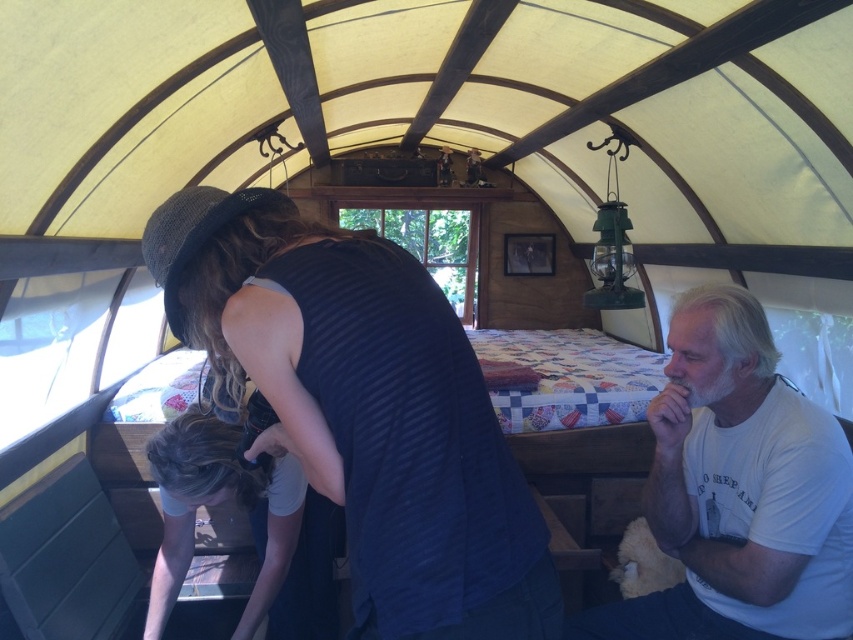
Does white cotton t-shirt at right appear on the left side of dark blue fabric at center?

Incorrect, white cotton t-shirt at right is not on the left side of dark blue fabric at center.

Can you confirm if white cotton t-shirt at right is positioned below dark blue fabric at center?

No, white cotton t-shirt at right is not below dark blue fabric at center.

This screenshot has width=853, height=640. In order to click on white cotton t-shirt at right in this screenshot , I will do `click(740, 490)`.

Is dark blue ribbed tank top at center to the right of white cotton t-shirt at right from the viewer's perspective?

In fact, dark blue ribbed tank top at center is to the left of white cotton t-shirt at right.

Between dark blue ribbed tank top at center and white cotton t-shirt at right, which one has more height?

With more height is white cotton t-shirt at right.

Image resolution: width=853 pixels, height=640 pixels. Describe the element at coordinates (364, 408) in the screenshot. I see `dark blue ribbed tank top at center` at that location.

The height and width of the screenshot is (640, 853). I want to click on dark blue ribbed tank top at center, so click(x=364, y=408).

Does dark blue ribbed tank top at center have a greater width compared to dark blue fabric at center?

Yes, dark blue ribbed tank top at center is wider than dark blue fabric at center.

Image resolution: width=853 pixels, height=640 pixels. I want to click on dark blue ribbed tank top at center, so click(364, 408).

This screenshot has width=853, height=640. What are the coordinates of `dark blue ribbed tank top at center` in the screenshot? It's located at (364, 408).